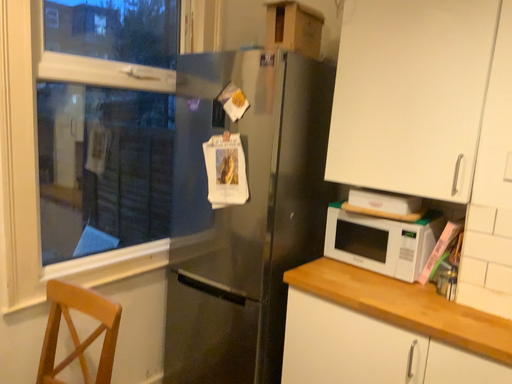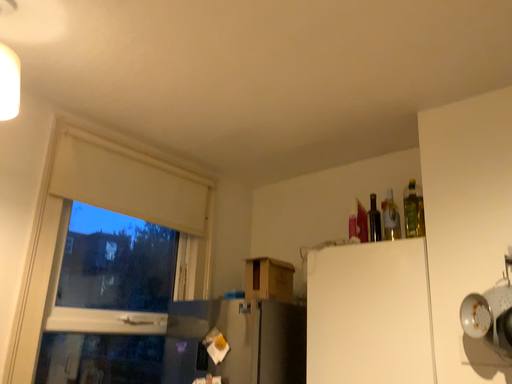
Question: Which way did the camera rotate in the video?

Choices:
 (A) rotated upward
 (B) rotated downward

Answer: (A)